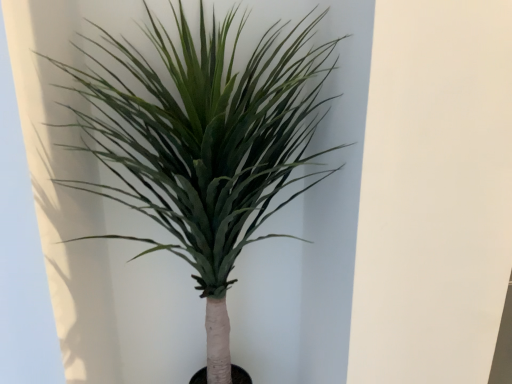
Measure the distance between green matte plant at center and camera.

The depth of green matte plant at center is 30.24 inches.

Locate an element on the screen. green matte plant at center is located at coordinates (205, 142).

Image resolution: width=512 pixels, height=384 pixels. What do you see at coordinates (205, 142) in the screenshot? I see `green matte plant at center` at bounding box center [205, 142].

You are a GUI agent. You are given a task and a screenshot of the screen. Output one action in this format:
    pyautogui.click(x=<x>, y=<y>)
    Task: Click on the green matte plant at center
    Image resolution: width=512 pixels, height=384 pixels.
    Given the screenshot: What is the action you would take?
    pyautogui.click(x=205, y=142)